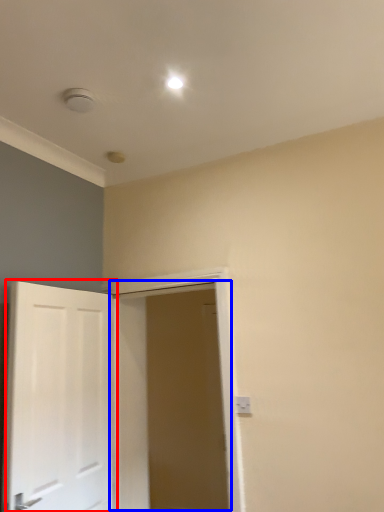
Question: Which point is closer to the camera, door (highlighted by a red box) or door (highlighted by a blue box)?

Choices:
 (A) door
 (B) door

Answer: (A)